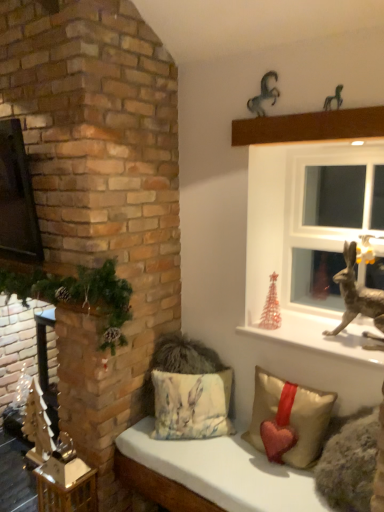
Identify the location of vacant space to the left of white plastic window at upper right. (291, 321).